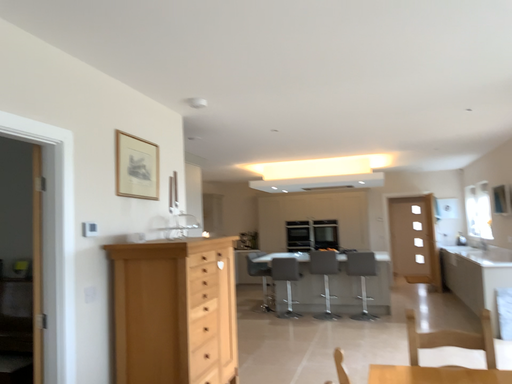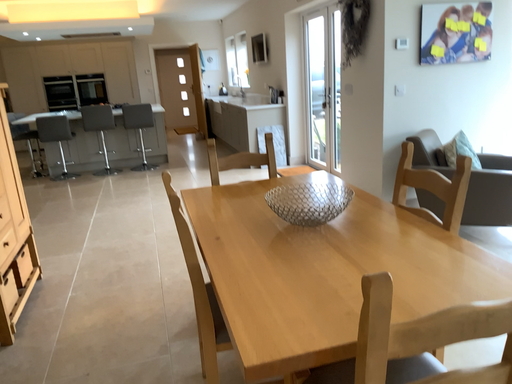
Question: Which way did the camera rotate in the video?

Choices:
 (A) rotated left
 (B) rotated right

Answer: (B)